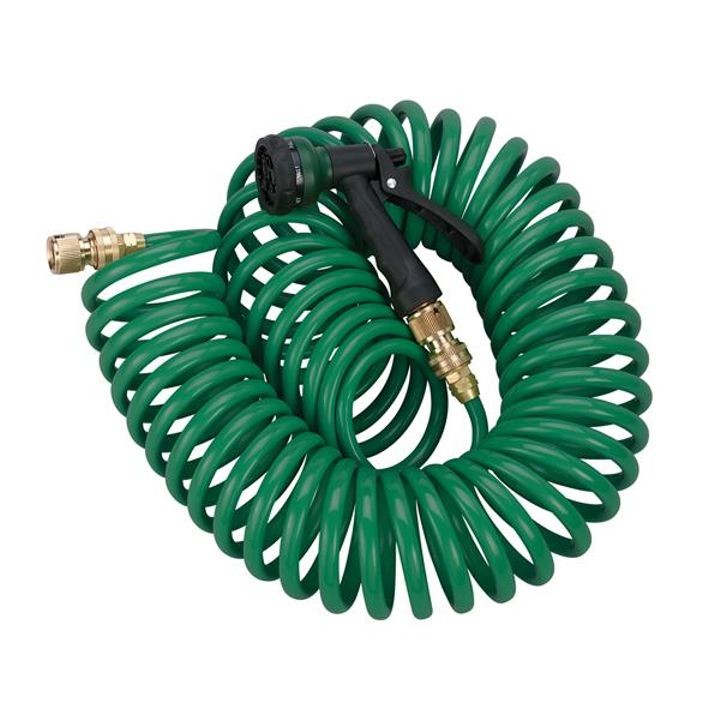
Find the location of a particular element. handle is located at coordinates (374, 240).